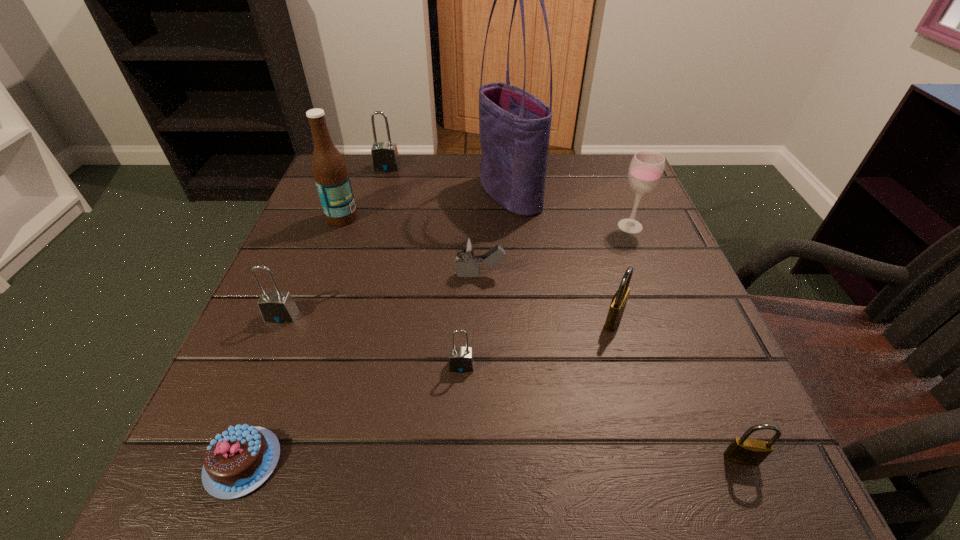
Where is `free space that satisfies the following two spatial constraints: 1. on the front side of the bigger brass padlock; 2. on the right side of the rightmost padlock`? The height and width of the screenshot is (540, 960). free space that satisfies the following two spatial constraints: 1. on the front side of the bigger brass padlock; 2. on the right side of the rightmost padlock is located at coordinates (653, 458).

Where is `free space in the image that satisfies the following two spatial constraints: 1. on the shackle of the pink chocolate cake; 2. on the right side of the leftmost padlock`? free space in the image that satisfies the following two spatial constraints: 1. on the shackle of the pink chocolate cake; 2. on the right side of the leftmost padlock is located at coordinates (220, 462).

You are a GUI agent. You are given a task and a screenshot of the screen. Output one action in this format:
    pyautogui.click(x=<x>, y=<y>)
    Task: Click on the free space that satisfies the following two spatial constraints: 1. on the shackle of the second biggest gray padlock; 2. on the right side of the rightmost padlock
    
    Given the screenshot: What is the action you would take?
    pyautogui.click(x=221, y=458)